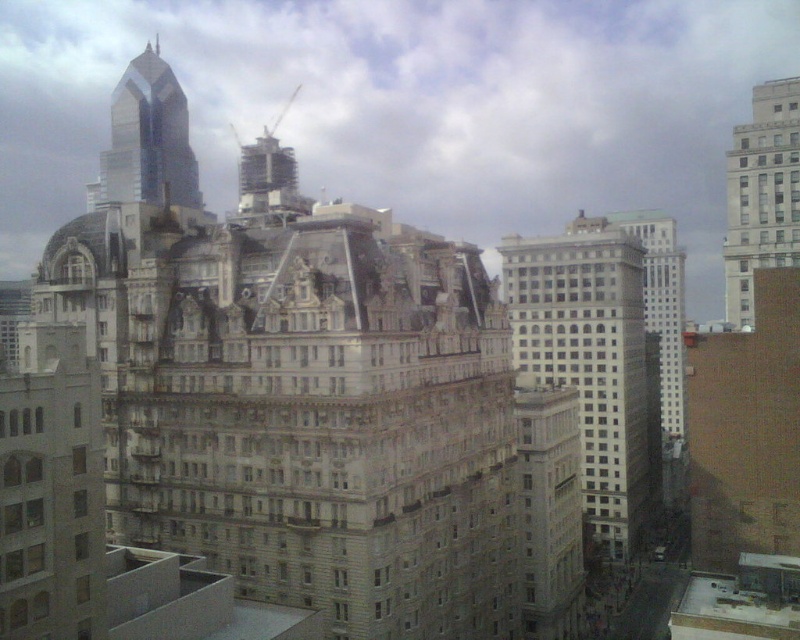
Question: Which of the following is the farthest from the observer?

Choices:
 (A) white stone building at upper right
 (B) shiny glass skyscraper at upper left
 (C) gray stone building at center

Answer: (A)

Question: Which point appears closest to the camera in this image?

Choices:
 (A) (508, 301)
 (B) (112, 141)
 (C) (768, 116)

Answer: (C)

Question: From the image, what is the correct spatial relationship of white stone building at upper right in relation to shiny glass skyscraper at upper left?

Choices:
 (A) above
 (B) below

Answer: (B)

Question: Does white stone building at upper right have a greater width compared to shiny glass skyscraper at upper left?

Choices:
 (A) yes
 (B) no

Answer: (A)

Question: Which object appears closest to the camera in this image?

Choices:
 (A) shiny glass skyscraper at upper left
 (B) white stone building at upper right
 (C) gray stone building at center

Answer: (A)

Question: From the image, what is the correct spatial relationship of white stone building at upper right in relation to shiny glass skyscraper at upper left?

Choices:
 (A) left
 (B) right

Answer: (B)